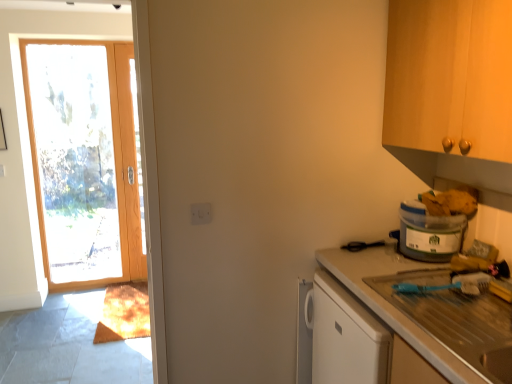
Measure the distance between point (x=65, y=103) and camera.

Point (x=65, y=103) and camera are 3.74 meters apart.

Measure the distance between translucent plastic container at right and camera.

translucent plastic container at right and camera are 5.69 feet apart.

Image resolution: width=512 pixels, height=384 pixels. Find the location of `white plastic electric outlet at center`. white plastic electric outlet at center is located at coordinates (201, 213).

Is wooden door at left looking in the opposite direction of translucent plastic container at right?

No.

Is wooden door at left shorter than translucent plastic container at right?

No.

I want to click on appliance on the right of wooden door at left, so (429, 233).

From the image's perspective, which one is positioned higher, wooden door at left or translucent plastic container at right?

wooden door at left is shown above in the image.

Measure the distance from smooth white countertop at right to white plastic electric outlet at center.

34.60 inches.

Could you tell me if smooth white countertop at right is turned towards white plastic electric outlet at center?

Yes, smooth white countertop at right is oriented towards white plastic electric outlet at center.

Which of these two, smooth white countertop at right or white plastic electric outlet at center, stands shorter?

Standing shorter between the two is white plastic electric outlet at center.

From the image's perspective, which one is positioned higher, smooth white countertop at right or white plastic electric outlet at center?

white plastic electric outlet at center.

Looking at this image, which of these two, translucent plastic container at right or white plastic electric outlet at center, stands shorter?

Standing shorter between the two is white plastic electric outlet at center.

At what (x,y) coordinates should I click in order to perform the action: click on electric outlet above the translucent plastic container at right (from the image's perspective). Please return your answer as a coordinate pair (x, y). The image size is (512, 384). Looking at the image, I should click on (201, 213).

Can you confirm if translucent plastic container at right is positioned to the left of white plastic electric outlet at center?

No, translucent plastic container at right is not to the left of white plastic electric outlet at center.

In the scene shown: From a real-world perspective, is translucent plastic container at right physically below white plastic electric outlet at center?

Correct, in the physical world, translucent plastic container at right is lower than white plastic electric outlet at center.

Is point (136, 248) in front of point (482, 345)?

No, it is not.

From a real-world perspective, between wooden door at left and smooth white countertop at right, who is vertically lower?

In real-world perspective, smooth white countertop at right is lower.

Between wooden door at left and smooth white countertop at right, which one has larger width?

With larger width is smooth white countertop at right.

The width and height of the screenshot is (512, 384). What are the coordinates of `countertop on the right of wooden door at left` in the screenshot? It's located at (426, 310).

Is smooth white countertop at right located within translucent plastic container at right?

Actually, smooth white countertop at right is outside translucent plastic container at right.

Considering the sizes of translucent plastic container at right and smooth white countertop at right in the image, is translucent plastic container at right taller or shorter than smooth white countertop at right?

translucent plastic container at right is shorter than smooth white countertop at right.

From the image's perspective, is translucent plastic container at right above smooth white countertop at right?

Yes, from the image's perspective, translucent plastic container at right is over smooth white countertop at right.

The image size is (512, 384). There is a smooth white countertop at right. Find the location of `door above it (from a real-world perspective)`. door above it (from a real-world perspective) is located at coordinates (84, 161).

Which of these two, smooth white countertop at right or wooden door at left, is bigger?

Bigger between the two is smooth white countertop at right.

From a real-world perspective, is smooth white countertop at right located higher than wooden door at left?

No, from a real-world perspective, smooth white countertop at right is not on top of wooden door at left.

Considering the relative sizes of smooth white countertop at right and wooden door at left in the image provided, is smooth white countertop at right shorter than wooden door at left?

Indeed, smooth white countertop at right has a lesser height compared to wooden door at left.

From the image's perspective, is white plastic electric outlet at center above or below wooden door at left?

Based on their image positions, white plastic electric outlet at center is located beneath wooden door at left.

From the picture: Could you tell me if white plastic electric outlet at center is facing wooden door at left?

No, white plastic electric outlet at center is not aimed at wooden door at left.

Is white plastic electric outlet at center positioned in front of wooden door at left?

Yes, it is in front of wooden door at left.

In order to click on appliance below the wooden door at left (from the image's perspective) in this screenshot , I will do `click(429, 233)`.

The width and height of the screenshot is (512, 384). In order to click on countertop that is in front of the white plastic electric outlet at center in this screenshot , I will do `click(426, 310)`.

Which object lies further to the anchor point translucent plastic container at right, white plastic electric outlet at center or smooth white countertop at right?

The object further to translucent plastic container at right is white plastic electric outlet at center.

Which object lies nearer to the anchor point translucent plastic container at right, wooden door at left or white plastic electric outlet at center?

white plastic electric outlet at center is closer to translucent plastic container at right.

Estimate the real-world distances between objects in this image. Which object is closer to wooden door at left, translucent plastic container at right or smooth white countertop at right?

smooth white countertop at right is closer to wooden door at left.

From the image, which object appears to be farther from wooden door at left, smooth white countertop at right or white plastic electric outlet at center?

smooth white countertop at right lies further to wooden door at left than the other object.

From the image, which object appears to be nearer to smooth white countertop at right, translucent plastic container at right or wooden door at left?

translucent plastic container at right is positioned closer to the anchor smooth white countertop at right.

Based on their spatial positions, is wooden door at left or white plastic electric outlet at center further from smooth white countertop at right?

wooden door at left lies further to smooth white countertop at right than the other object.

Looking at the image, which one is located closer to translucent plastic container at right, wooden door at left or smooth white countertop at right?

Based on the image, smooth white countertop at right appears to be nearer to translucent plastic container at right.

Estimate the real-world distances between objects in this image. Which object is further from wooden door at left, smooth white countertop at right or translucent plastic container at right?

translucent plastic container at right is positioned further to the anchor wooden door at left.

Image resolution: width=512 pixels, height=384 pixels. In order to click on electric outlet between smooth white countertop at right and wooden door at left from front to back in this screenshot , I will do `click(201, 213)`.

This screenshot has width=512, height=384. Find the location of `countertop between wooden door at left and translucent plastic container at right`. countertop between wooden door at left and translucent plastic container at right is located at coordinates [426, 310].

This screenshot has width=512, height=384. Find the location of `electric outlet located between wooden door at left and translucent plastic container at right in the left-right direction`. electric outlet located between wooden door at left and translucent plastic container at right in the left-right direction is located at coordinates (201, 213).

This screenshot has height=384, width=512. Identify the location of countertop between white plastic electric outlet at center and translucent plastic container at right. (426, 310).